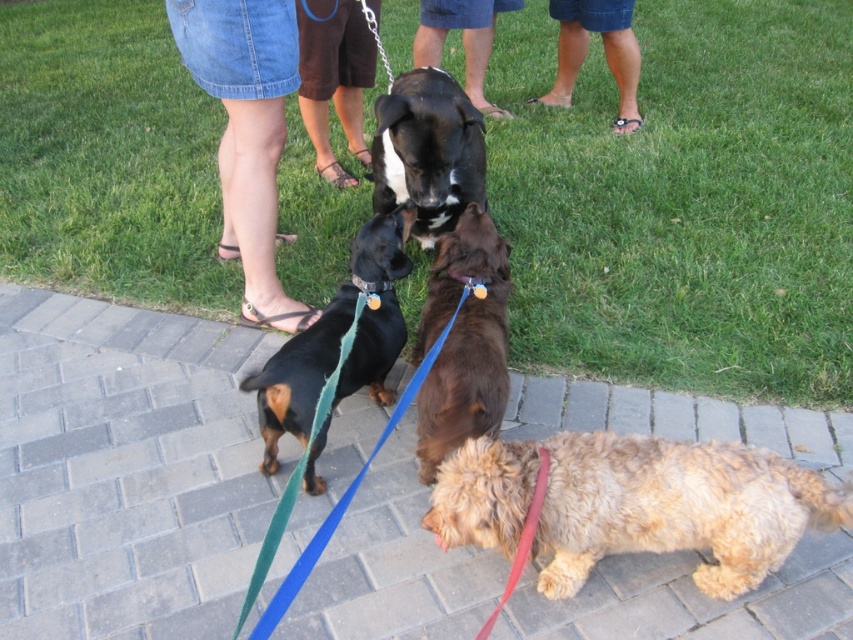
You are a photographer standing on the pathway. You want to take a picture of the green grass at center and the blue denim shorts at upper center. Which object should you focus on first to ensure both are in clear view?

The green grass at center is closer to the viewer than the blue denim shorts at upper center, so focus on the green grass at center first to ensure both are in clear view.

You are standing at the lower center of the image and notice the brown denim shorts at lower center. Based on the coordinates provided, can you determine if the shorts are positioned closer to the bottom or the top of the image?

The brown denim shorts at lower center are located at point 0.078 along the vertical axis, which is closer to the bottom of the image since lower values on the vertical axis typically indicate positions nearer the bottom.

You are standing at the camera position and want to throw a treat to the closest point between point A at point [524,186] and point B at point [428,32]. Which point should you aim for to reach the closer one?

Point A at point [524,186] is closer to the camera than point B at point [428,32], so you should aim for point A at point [524,186] to reach the closer one.